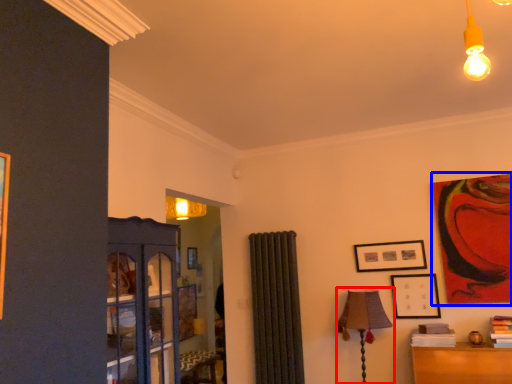
Question: Which of the following is the farthest to the observer, table lamp (highlighted by a red box) or picture frame (highlighted by a blue box)?

Choices:
 (A) table lamp
 (B) picture frame

Answer: (B)